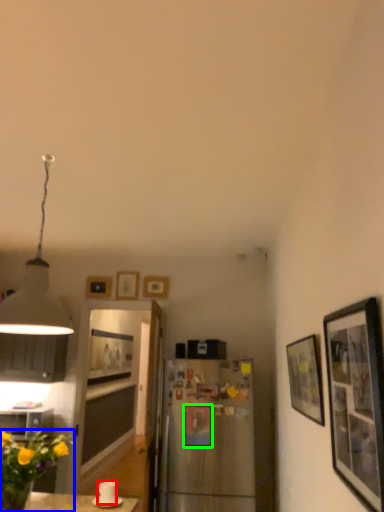
Question: Estimate the real-world distances between objects in this image. Which object is closer to coffee cup (highlighted by a red box), flower (highlighted by a blue box) or picture frame (highlighted by a green box)?

Choices:
 (A) flower
 (B) picture frame

Answer: (A)